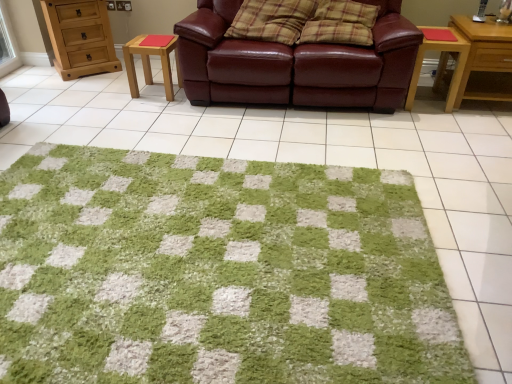
Find the location of a particular element. The width and height of the screenshot is (512, 384). free location in front of light brown wooden chest of drawers at upper left is located at coordinates (74, 84).